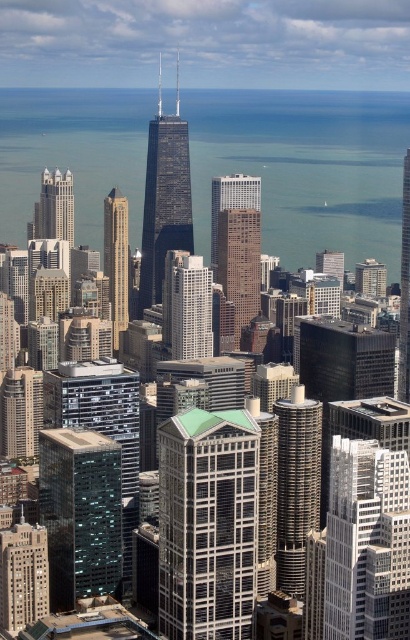
Question: Which point appears farthest from the camera in this image?

Choices:
 (A) (389, 257)
 (B) (127, 305)
 (C) (239, 310)

Answer: (A)

Question: In this image, where is glassy reflective skyscraper at center located relative to glassy reflective skyscraper at right?

Choices:
 (A) right
 (B) left

Answer: (B)

Question: Is black glass skyscraper at center bigger than glassy reflective skyscraper at center?

Choices:
 (A) no
 (B) yes

Answer: (B)

Question: Which of the following is the closest to the observer?

Choices:
 (A) blue glass water at center
 (B) white glass building at center

Answer: (B)

Question: Considering the relative positions of green glass building at center and matte glass building at lower left in the image provided, where is green glass building at center located with respect to matte glass building at lower left?

Choices:
 (A) above
 (B) below

Answer: (A)

Question: Based on their relative distances, which object is farther from the green glass building at center?

Choices:
 (A) black glass skyscraper at center
 (B) white glass building at center
 (C) blue glass water at center
 (D) matte glass skyscraper at center

Answer: (D)